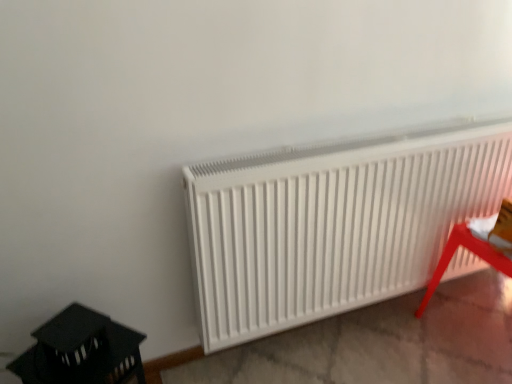
Question: In terms of height, does white matte radiator at center look taller or shorter compared to metallic red stool at lower right, which is the second furniture in left-to-right order?

Choices:
 (A) tall
 (B) short

Answer: (A)

Question: Based on their positions, is white matte radiator at center located to the left or right of metallic red stool at lower right, which is counted as the 1th furniture, starting from the right?

Choices:
 (A) right
 (B) left

Answer: (B)

Question: Considering the real-world distances, which object is farthest from the metallic red stool at lower right, which is the second furniture in left-to-right order?

Choices:
 (A) white matte radiator at center
 (B) black plastic lantern at lower left, which appears as the 1th furniture when viewed from the left

Answer: (B)

Question: Estimate the real-world distances between objects in this image. Which object is farther from the metallic red stool at lower right, which is counted as the 1th furniture, starting from the right?

Choices:
 (A) white matte radiator at center
 (B) black plastic lantern at lower left, which is the second furniture from right to left

Answer: (B)